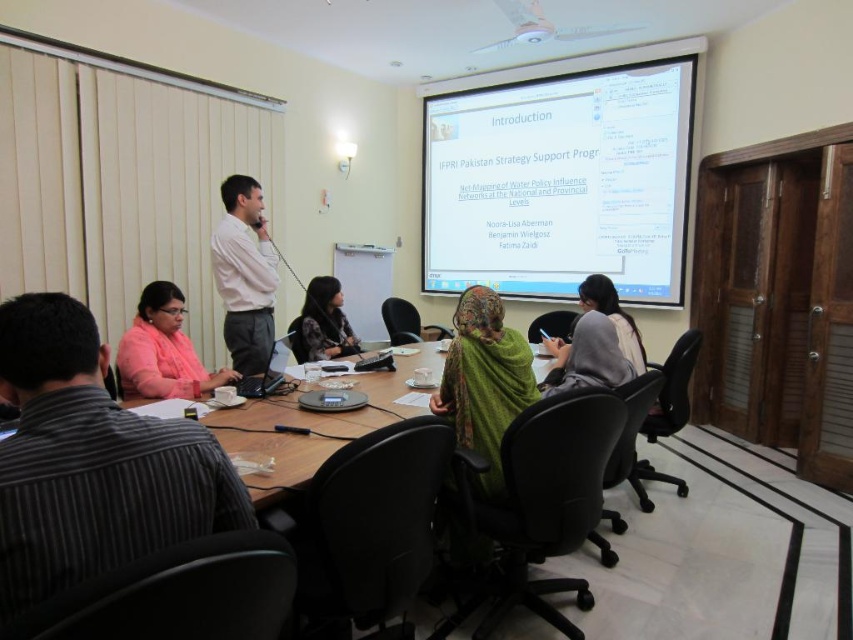
You are standing at the entrance of the meeting room and see the striped shirt at lower left and the gray fabric jacket at center. Which one is positioned more to the left side of the room?

The striped shirt at lower left is positioned more to the left side of the room than the gray fabric jacket at center.

You are standing in the meeting room and notice two items on the table. The striped shirt at lower left and the gray fabric jacket at center. Which item is shorter in height?

The striped shirt at lower left is not as tall as the gray fabric jacket at center, so the striped shirt at lower left is shorter in height.

You are a person with a height of 6 feet. You are standing at the location of the striped shirt at lower left and want to reach the wooden table at center. Do you think you can comfortably reach the table without moving your feet?

The distance between the striped shirt at lower left and the wooden table at center is 30.82 inches. Since the average arm span for a person of 6 feet is about 70 inches, you can comfortably reach the wooden table at center from the striped shirt at lower left without moving your feet.